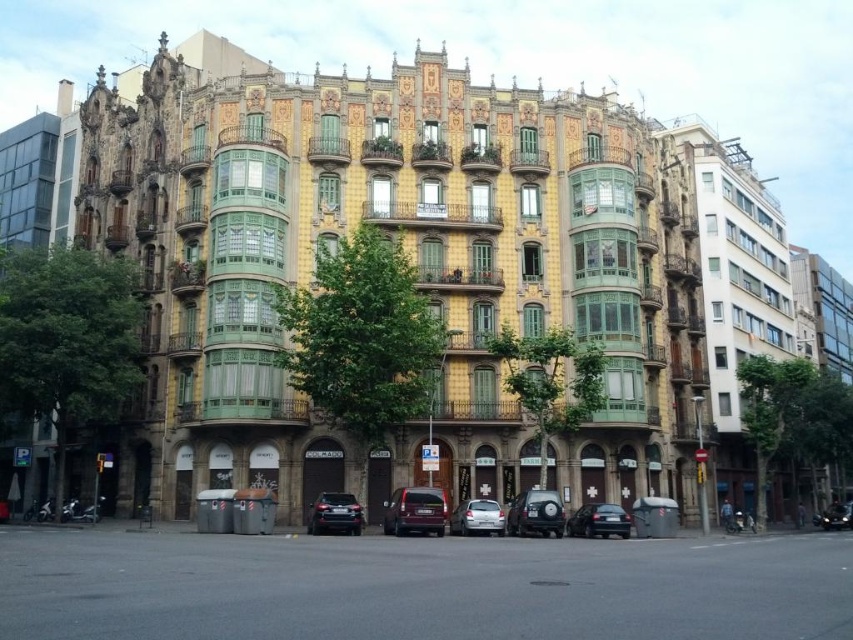
Question: Does silver metallic car at center come behind shiny black car at lower right?

Choices:
 (A) no
 (B) yes

Answer: (A)

Question: Is satin burgundy suv at center behind satin black car at center?

Choices:
 (A) no
 (B) yes

Answer: (A)

Question: Which object appears closest to the camera in this image?

Choices:
 (A) shiny black car at lower right
 (B) silver metallic car at center

Answer: (B)

Question: From the image, what is the correct spatial relationship of shiny black suv at center in relation to shiny black sedan at lower center?

Choices:
 (A) below
 (B) above

Answer: (A)

Question: Which of the following is the farthest from the observer?

Choices:
 (A) (595, 504)
 (B) (824, 528)
 (C) (335, 508)

Answer: (B)

Question: Among these points, which one is nearest to the camera?

Choices:
 (A) (618, 532)
 (B) (473, 531)

Answer: (B)